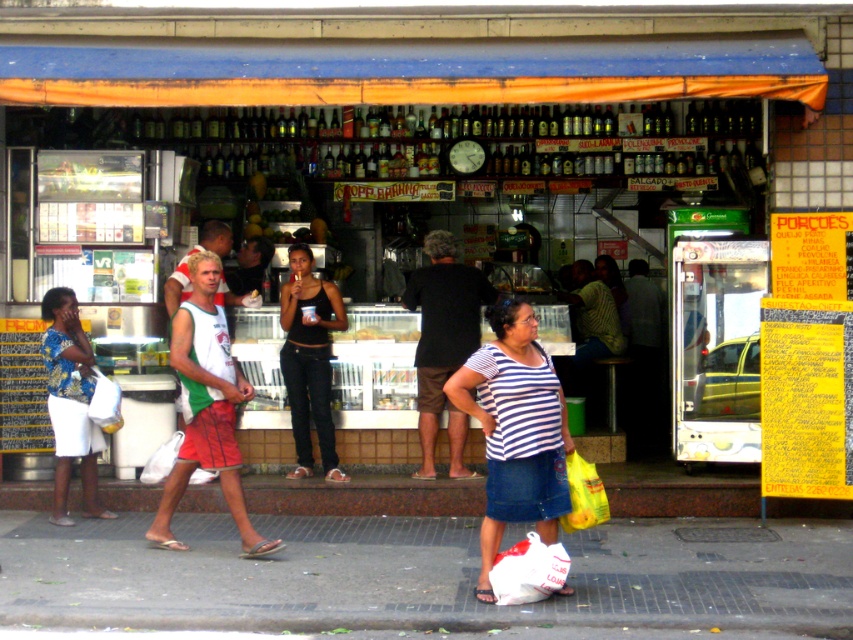
You are a delivery person with a box that is 3 meters long. You need to place the box between the striped cotton shirt at center and the black matte tank top at center. Can the box fit in the space between them?

The striped cotton shirt at center and black matte tank top at center are 2.73 meters apart from each other. The box is 3 meters long, so it cannot fit in the space between them because the distance is shorter than the box length.

Based on the photo, you are a customer standing in front of the shop and see the black matte tank top at center. Where exactly is it located in the image?

The black matte tank top at center is located at point 0.562 on the horizontal axis and 0.363 on the vertical axis.